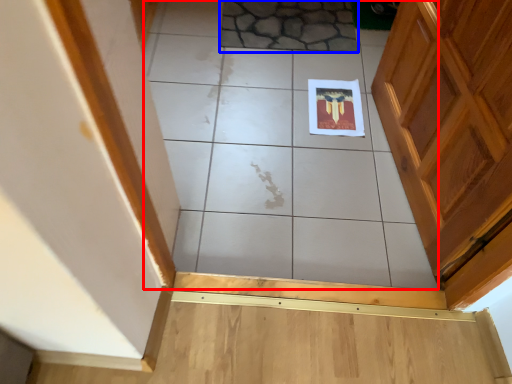
Question: Which of the following is the closest to the observer, ceramic tile (highlighted by a red box) or ceramic tile (highlighted by a blue box)?

Choices:
 (A) ceramic tile
 (B) ceramic tile

Answer: (A)